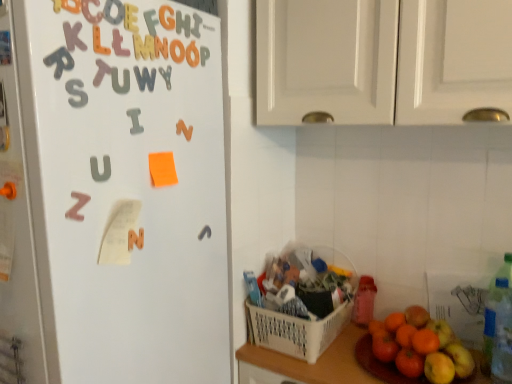
Question: Choose the correct answer: Is orange matte grapefruit at lower right inside matte plastic letter at upper center, placed as the second alphabet when sorted from left to right, or outside it?

Choices:
 (A) inside
 (B) outside

Answer: (B)

Question: In terms of height, does orange matte grapefruit at lower right look taller or shorter compared to matte plastic letter at upper center, positioned as the 3th alphabet in bottom-to-top order?

Choices:
 (A) tall
 (B) short

Answer: (A)

Question: Considering the real-world distances, which object is closest to the orange matte grapefruit at lower right?

Choices:
 (A) yellow foam letter e at upper center, placed as the second alphabet when sorted from top to bottom
 (B) metallic silver letter at upper center, placed as the 7th alphabet when sorted from bottom to top
 (C) metallic orange letter at upper center, the fifth alphabet when ordered from left to right
 (D) translucent plastic bottle at right
 (E) white magnetic letters at left

Answer: (D)

Question: Which object is the closest to the orange matte letter at upper center, the 3th alphabet viewed from the top?

Choices:
 (A) orange matte letter u at upper center, arranged as the fifth alphabet when viewed from the right
 (B) white plastic basket at lower center
 (C) orange paper at upper center
 (D) metallic orange letter at upper center, positioned as the 4th alphabet in bottom-to-top order
 (E) orange matte grapefruit at lower right

Answer: (D)